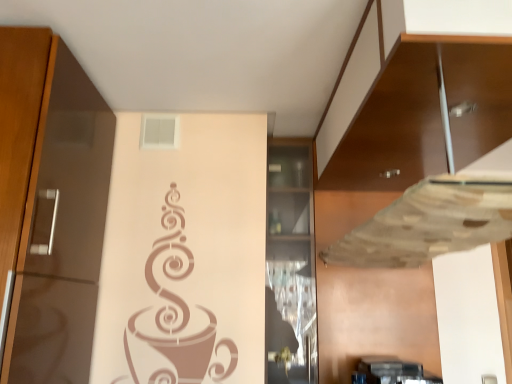
Find the location of a particular element. Image resolution: width=512 pixels, height=384 pixels. transparent glass cabinet at center, which appears as the 2th cabinetry when viewed from the right is located at coordinates (290, 264).

What do you see at coordinates (290, 264) in the screenshot?
I see `transparent glass cabinet at center, which appears as the 2th cabinetry when viewed from the right` at bounding box center [290, 264].

Identify the location of matte brown cabinet at right, which is the 2th cabinetry from left to right. (425, 113).

Describe the element at coordinates (425, 113) in the screenshot. I see `matte brown cabinet at right, which is the 2th cabinetry from left to right` at that location.

Find the location of `transparent glass cabinet at center, which appears as the 2th cabinetry when viewed from the right`. transparent glass cabinet at center, which appears as the 2th cabinetry when viewed from the right is located at coordinates (290, 264).

Between transparent glass cabinet at center, which appears as the 2th cabinetry when viewed from the right, and matte brown cabinet at right, which is the 1th cabinetry from right to left, which one appears on the right side from the viewer's perspective?

matte brown cabinet at right, which is the 1th cabinetry from right to left.

Which is in front, transparent glass cabinet at center, the 1th cabinetry in the left-to-right sequence, or matte brown cabinet at right, which is the 2th cabinetry from left to right?

matte brown cabinet at right, which is the 2th cabinetry from left to right, is closer to the camera.

Considering the points (303, 245) and (423, 168), which point is in front, point (303, 245) or point (423, 168)?

The point (423, 168) is closer.

From the image's perspective, is transparent glass cabinet at center, which appears as the 2th cabinetry when viewed from the right, above or below matte brown cabinet at right, which is the 1th cabinetry from right to left?

Based on their image positions, transparent glass cabinet at center, which appears as the 2th cabinetry when viewed from the right, is located beneath matte brown cabinet at right, which is the 1th cabinetry from right to left.

From a real-world perspective, who is located higher, transparent glass cabinet at center, which appears as the 2th cabinetry when viewed from the right, or matte brown cabinet at right, which is the 1th cabinetry from right to left?

In real-world perspective, matte brown cabinet at right, which is the 1th cabinetry from right to left, is above.

Is transparent glass cabinet at center, which appears as the 2th cabinetry when viewed from the right, wider than matte brown cabinet at right, which is the 2th cabinetry from left to right?

No.

Between transparent glass cabinet at center, the 1th cabinetry in the left-to-right sequence, and matte brown cabinet at right, which is the 1th cabinetry from right to left, which one has more height?

Standing taller between the two is transparent glass cabinet at center, the 1th cabinetry in the left-to-right sequence.

In terms of size, does transparent glass cabinet at center, which appears as the 2th cabinetry when viewed from the right, appear bigger or smaller than matte brown cabinet at right, which is the 1th cabinetry from right to left?

transparent glass cabinet at center, which appears as the 2th cabinetry when viewed from the right, is smaller than matte brown cabinet at right, which is the 1th cabinetry from right to left.

Is transparent glass cabinet at center, which appears as the 2th cabinetry when viewed from the right, outside of matte brown cabinet at right, which is the 1th cabinetry from right to left?

Yes, transparent glass cabinet at center, which appears as the 2th cabinetry when viewed from the right, is located beyond the bounds of matte brown cabinet at right, which is the 1th cabinetry from right to left.

Is transparent glass cabinet at center, which appears as the 2th cabinetry when viewed from the right, next to matte brown cabinet at right, which is the 1th cabinetry from right to left, and touching it?

No.

Could you tell me if transparent glass cabinet at center, which appears as the 2th cabinetry when viewed from the right, is facing matte brown cabinet at right, which is the 2th cabinetry from left to right?

No, transparent glass cabinet at center, which appears as the 2th cabinetry when viewed from the right, is not facing towards matte brown cabinet at right, which is the 2th cabinetry from left to right.

How many degrees apart are the facing directions of transparent glass cabinet at center, which appears as the 2th cabinetry when viewed from the right, and matte brown cabinet at right, which is the 2th cabinetry from left to right?

90 degrees.

Measure the distance between transparent glass cabinet at center, which appears as the 2th cabinetry when viewed from the right, and matte brown cabinet at right, which is the 1th cabinetry from right to left.

transparent glass cabinet at center, which appears as the 2th cabinetry when viewed from the right, is 68.46 centimeters from matte brown cabinet at right, which is the 1th cabinetry from right to left.

At what (x,y) coordinates should I click in order to perform the action: click on cabinetry above the transparent glass cabinet at center, which appears as the 2th cabinetry when viewed from the right (from a real-world perspective). Please return your answer as a coordinate pair (x, y). Looking at the image, I should click on (425, 113).

Considering the relative positions of matte brown cabinet at right, which is the 2th cabinetry from left to right, and transparent glass cabinet at center, the 1th cabinetry in the left-to-right sequence, in the image provided, is matte brown cabinet at right, which is the 2th cabinetry from left to right, to the right of transparent glass cabinet at center, the 1th cabinetry in the left-to-right sequence, from the viewer's perspective?

Correct, you'll find matte brown cabinet at right, which is the 2th cabinetry from left to right, to the right of transparent glass cabinet at center, the 1th cabinetry in the left-to-right sequence.

Considering their positions, is matte brown cabinet at right, which is the 2th cabinetry from left to right, located in front of or behind transparent glass cabinet at center, the 1th cabinetry in the left-to-right sequence?

In the image, matte brown cabinet at right, which is the 2th cabinetry from left to right, appears in front of transparent glass cabinet at center, the 1th cabinetry in the left-to-right sequence.

Is point (370, 172) more distant than point (283, 282)?

No, it is not.

From the image's perspective, which one is positioned lower, matte brown cabinet at right, which is the 1th cabinetry from right to left, or transparent glass cabinet at center, which appears as the 2th cabinetry when viewed from the right?

transparent glass cabinet at center, which appears as the 2th cabinetry when viewed from the right, is shown below in the image.

From a real-world perspective, is matte brown cabinet at right, which is the 1th cabinetry from right to left, physically above transparent glass cabinet at center, the 1th cabinetry in the left-to-right sequence?

Yes, from a real-world perspective, matte brown cabinet at right, which is the 1th cabinetry from right to left, is on top of transparent glass cabinet at center, the 1th cabinetry in the left-to-right sequence.

Is matte brown cabinet at right, which is the 2th cabinetry from left to right, wider or thinner than transparent glass cabinet at center, the 1th cabinetry in the left-to-right sequence?

In the image, matte brown cabinet at right, which is the 2th cabinetry from left to right, appears to be wider than transparent glass cabinet at center, the 1th cabinetry in the left-to-right sequence.

Is matte brown cabinet at right, which is the 1th cabinetry from right to left, taller than transparent glass cabinet at center, the 1th cabinetry in the left-to-right sequence?

In fact, matte brown cabinet at right, which is the 1th cabinetry from right to left, may be shorter than transparent glass cabinet at center, the 1th cabinetry in the left-to-right sequence.

Which of these two, matte brown cabinet at right, which is the 1th cabinetry from right to left, or transparent glass cabinet at center, which appears as the 2th cabinetry when viewed from the right, is smaller?

With smaller size is transparent glass cabinet at center, which appears as the 2th cabinetry when viewed from the right.

Do you think matte brown cabinet at right, which is the 2th cabinetry from left to right, is within transparent glass cabinet at center, which appears as the 2th cabinetry when viewed from the right, or outside of it?

The correct answer is: outside.

Are matte brown cabinet at right, which is the 1th cabinetry from right to left, and transparent glass cabinet at center, the 1th cabinetry in the left-to-right sequence, far apart?

That's not correct — matte brown cabinet at right, which is the 1th cabinetry from right to left, is a little close to transparent glass cabinet at center, the 1th cabinetry in the left-to-right sequence.

In the scene shown: Is matte brown cabinet at right, which is the 2th cabinetry from left to right, facing towards transparent glass cabinet at center, which appears as the 2th cabinetry when viewed from the right?

No, matte brown cabinet at right, which is the 2th cabinetry from left to right, is not facing towards transparent glass cabinet at center, which appears as the 2th cabinetry when viewed from the right.

How different are the orientations of matte brown cabinet at right, which is the 2th cabinetry from left to right, and transparent glass cabinet at center, the 1th cabinetry in the left-to-right sequence, in degrees?

90 degrees separate the facing orientations of matte brown cabinet at right, which is the 2th cabinetry from left to right, and transparent glass cabinet at center, the 1th cabinetry in the left-to-right sequence.

Measure the distance from matte brown cabinet at right, which is the 1th cabinetry from right to left, to transparent glass cabinet at center, which appears as the 2th cabinetry when viewed from the right.

26.95 inches.

You are a GUI agent. You are given a task and a screenshot of the screen. Output one action in this format:
    pyautogui.click(x=<x>, y=<y>)
    Task: Click on the cabinetry lying in front of the transparent glass cabinet at center, which appears as the 2th cabinetry when viewed from the right
    
    Given the screenshot: What is the action you would take?
    pyautogui.click(x=425, y=113)

At what (x,y) coordinates should I click in order to perform the action: click on cabinetry that is on the left side of matte brown cabinet at right, which is the 1th cabinetry from right to left. Please return your answer as a coordinate pair (x, y). The image size is (512, 384). Looking at the image, I should click on (290, 264).

At what (x,y) coordinates should I click in order to perform the action: click on cabinetry lying behind the matte brown cabinet at right, which is the 1th cabinetry from right to left. Please return your answer as a coordinate pair (x, y). Looking at the image, I should click on (290, 264).